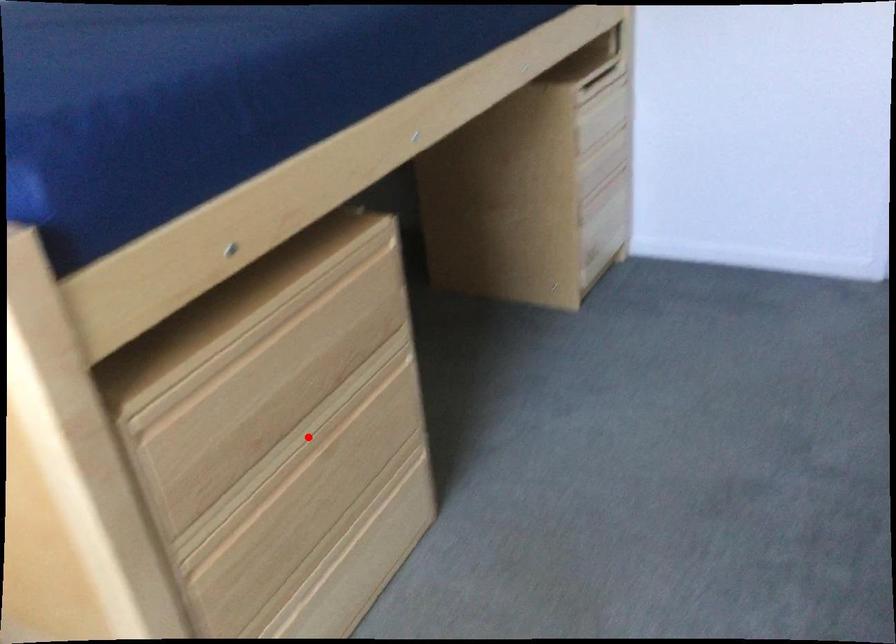
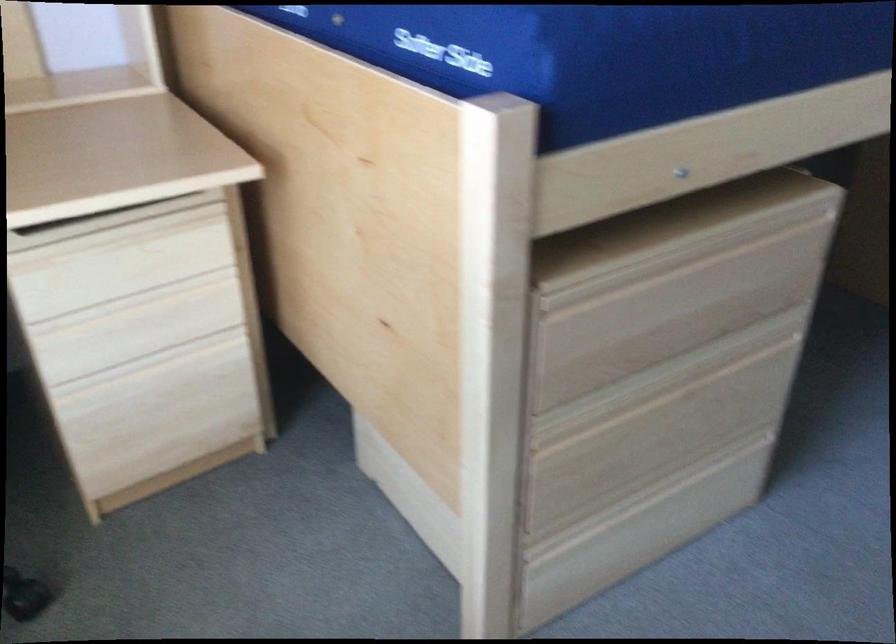
Where in the second image is the point corresponding to the highlighted location from the first image?

(673, 377)